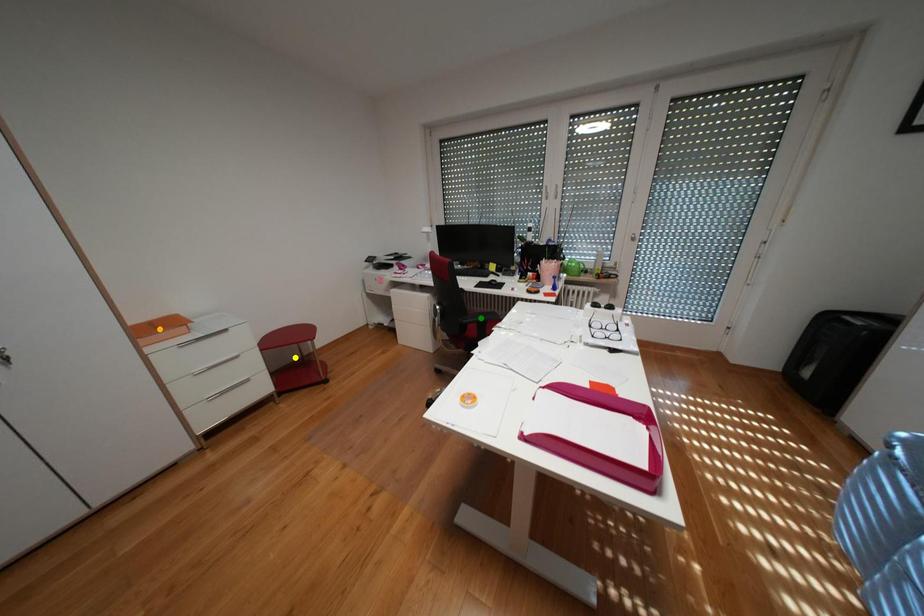
Order these from farthest to nearest:
yellow point, green point, orange point

yellow point, green point, orange point